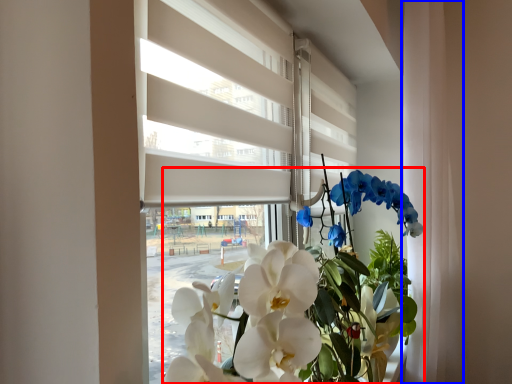
Question: Which of the following is the farthest to the observer, floral arrangement (highlighted by a red box) or curtain (highlighted by a blue box)?

Choices:
 (A) floral arrangement
 (B) curtain

Answer: (B)